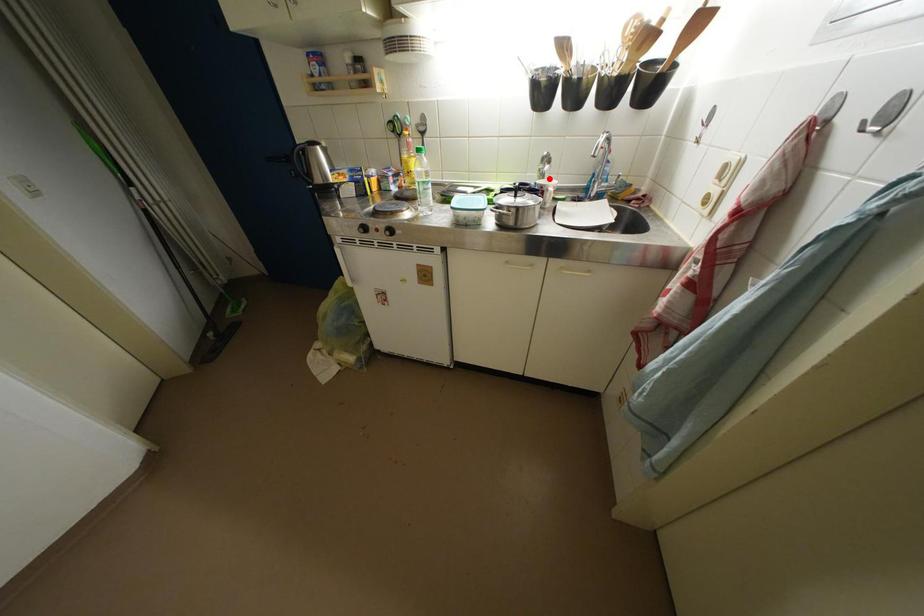
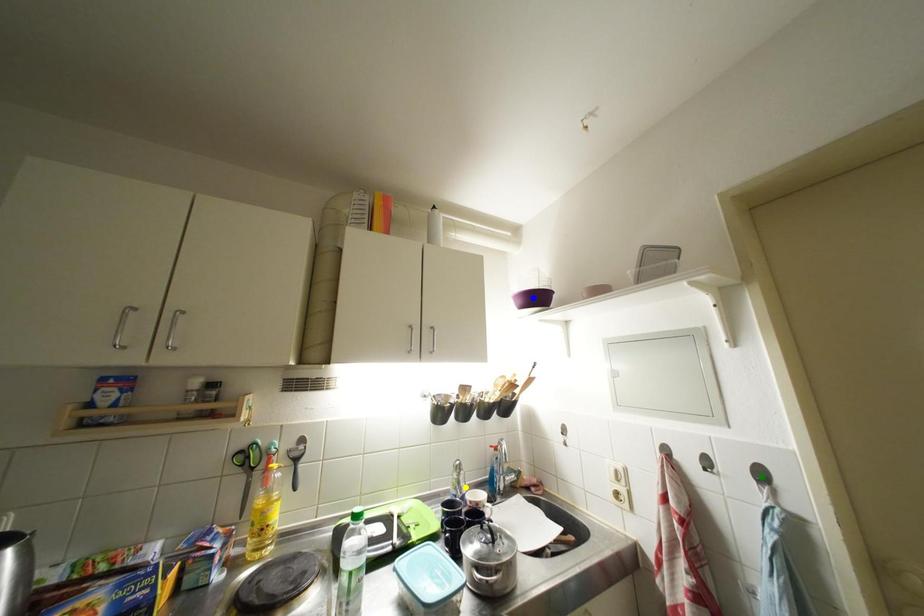
Question: I am providing you with two images of the same scene from different viewpoints. A red point is marked on the first image. You are given multiple points on the second image. In image 2, which mark is for the same physical point as the one in image 1?

Choices:
 (A) blue point
 (B) yellow point
 (C) green point

Answer: (B)